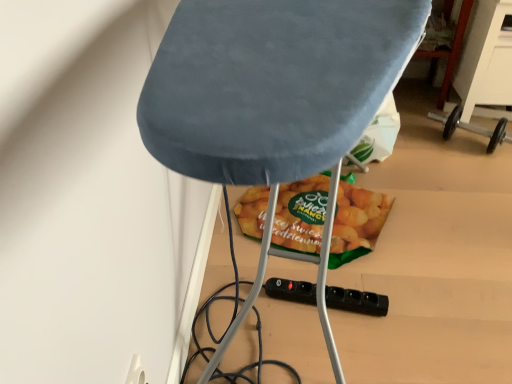
The width and height of the screenshot is (512, 384). Describe the element at coordinates (273, 91) in the screenshot. I see `velvet blue ironing board at center` at that location.

What do you see at coordinates (301, 214) in the screenshot? The height and width of the screenshot is (384, 512). I see `green matte snack at center` at bounding box center [301, 214].

Where is `velvet blue ironing board at center`? velvet blue ironing board at center is located at coordinates (273, 91).

From the image's perspective, which object appears higher, black plastic socket at lower center or green matte snack at center?

From the image's view, green matte snack at center is above.

Considering the sizes of black plastic socket at lower center and green matte snack at center in the image, is black plastic socket at lower center bigger or smaller than green matte snack at center?

Clearly, black plastic socket at lower center is smaller in size than green matte snack at center.

Looking at this image, from a real-world perspective, which is physically above, black plastic socket at lower center or green matte snack at center?

black plastic socket at lower center, from a real-world perspective.

Is black plastic socket at lower center next to green matte snack at center?

black plastic socket at lower center is not next to green matte snack at center, and they're not touching.

Considering the sizes of objects green matte snack at center and velvet blue ironing board at center in the image provided, who is wider, green matte snack at center or velvet blue ironing board at center?

Wider between the two is velvet blue ironing board at center.

Who is smaller, green matte snack at center or velvet blue ironing board at center?

green matte snack at center.

Is velvet blue ironing board at center at the back of green matte snack at center?

That's right, green matte snack at center is facing away from velvet blue ironing board at center.

Does green matte snack at center come behind velvet blue ironing board at center?

Yes.

Can you confirm if black plastic socket at lower center is positioned to the right of velvet blue ironing board at center?

Yes, black plastic socket at lower center is to the right of velvet blue ironing board at center.

Is black plastic socket at lower center next to velvet blue ironing board at center?

There is a gap between black plastic socket at lower center and velvet blue ironing board at center.

From a real-world perspective, between black plastic socket at lower center and velvet blue ironing board at center, who is vertically higher?

From a 3D spatial view, velvet blue ironing board at center is above.

Is black plastic socket at lower center turned away from velvet blue ironing board at center?

Correct, black plastic socket at lower center is looking away from velvet blue ironing board at center.

Considering the positions of point (287, 233) and point (311, 302), is point (287, 233) closer or farther from the camera than point (311, 302)?

Point (287, 233).

Looking at the image, does green matte snack at center seem bigger or smaller compared to black plastic socket at lower center?

Clearly, green matte snack at center is larger in size than black plastic socket at lower center.

Considering the positions of objects green matte snack at center and black plastic socket at lower center in the image provided, who is in front, green matte snack at center or black plastic socket at lower center?

black plastic socket at lower center.

Between green matte snack at center and black plastic socket at lower center, which one appears on the right side from the viewer's perspective?

From the viewer's perspective, black plastic socket at lower center appears more on the right side.

Between velvet blue ironing board at center and green matte snack at center, which one appears on the left side from the viewer's perspective?

velvet blue ironing board at center.

Based on the photo, from the image's perspective, is velvet blue ironing board at center over green matte snack at center?

Yes, from the image's perspective, velvet blue ironing board at center is over green matte snack at center.

Based on the photo, is velvet blue ironing board at center directly adjacent to green matte snack at center?

No, velvet blue ironing board at center is not making contact with green matte snack at center.

Measure the distance between velvet blue ironing board at center and green matte snack at center.

They are 97.99 centimeters apart.

Which is correct: velvet blue ironing board at center is inside black plastic socket at lower center, or outside of it?

velvet blue ironing board at center is located beyond the bounds of black plastic socket at lower center.

Is velvet blue ironing board at center facing towards black plastic socket at lower center?

No, velvet blue ironing board at center is not turned towards black plastic socket at lower center.

In the scene shown: Is velvet blue ironing board at center at the left side of black plastic socket at lower center?

Yes.

Does point (257, 88) appear closer or farther from the camera than point (306, 288)?

Point (257, 88) is closer to the camera than point (306, 288).

I want to click on snack that is behind the black plastic socket at lower center, so click(301, 214).

In order to click on furniture on the left of the green matte snack at center in this screenshot , I will do `click(273, 91)`.

From the image, which object appears to be nearer to velvet blue ironing board at center, black plastic socket at lower center or green matte snack at center?

black plastic socket at lower center.

Which object lies nearer to the anchor point black plastic socket at lower center, velvet blue ironing board at center or green matte snack at center?

green matte snack at center is positioned closer to the anchor black plastic socket at lower center.

Which object lies nearer to the anchor point green matte snack at center, velvet blue ironing board at center or black plastic socket at lower center?

black plastic socket at lower center is positioned closer to the anchor green matte snack at center.

Considering their positions, is green matte snack at center positioned further to velvet blue ironing board at center than black plastic socket at lower center?

green matte snack at center.

From the image, which object appears to be nearer to green matte snack at center, black plastic socket at lower center or velvet blue ironing board at center?

Among the two, black plastic socket at lower center is located nearer to green matte snack at center.

Based on their spatial positions, is green matte snack at center or velvet blue ironing board at center further from black plastic socket at lower center?

velvet blue ironing board at center is further to black plastic socket at lower center.

This screenshot has height=384, width=512. In order to click on socket positioned between velvet blue ironing board at center and green matte snack at center from near to far in this screenshot , I will do `click(356, 301)`.